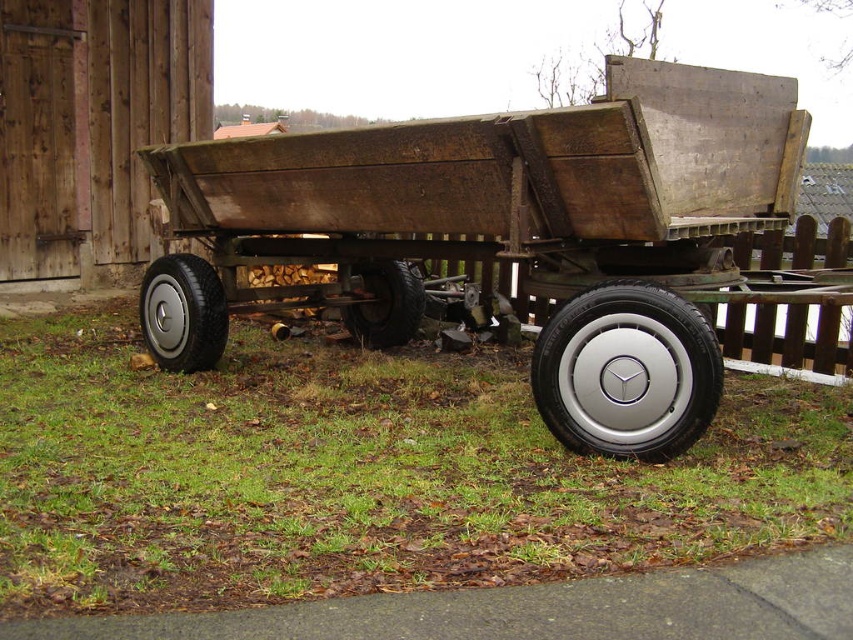
Question: Can you confirm if green grass at lower center is thinner than rusty wood wagon at center?

Choices:
 (A) yes
 (B) no

Answer: (A)

Question: Is green grass at lower center positioned before rubber/textured wheel at center?

Choices:
 (A) yes
 (B) no

Answer: (A)

Question: Can you confirm if silver metallic wheel at center is positioned below silver metallic wheel at lower left?

Choices:
 (A) no
 (B) yes

Answer: (B)

Question: Which of the following is the closest to the observer?

Choices:
 (A) (544, 484)
 (B) (142, 332)

Answer: (A)

Question: Which point is closer to the camera?

Choices:
 (A) (386, 570)
 (B) (635, 305)

Answer: (A)

Question: Which of the following is the farthest from the observer?

Choices:
 (A) (519, 116)
 (B) (41, 358)
 (C) (184, 272)
 (D) (633, 291)

Answer: (B)